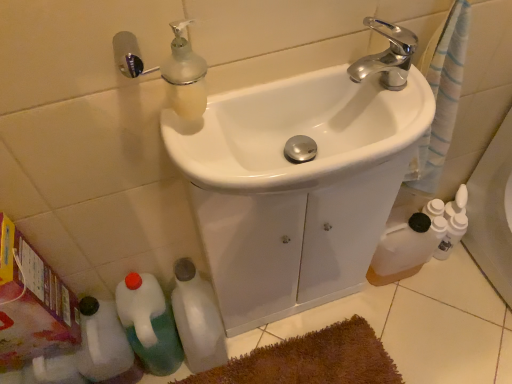
The height and width of the screenshot is (384, 512). Find the location of `blank space above brown plush bath mat at lower center (from a real-world perspective)`. blank space above brown plush bath mat at lower center (from a real-world perspective) is located at coordinates (298, 364).